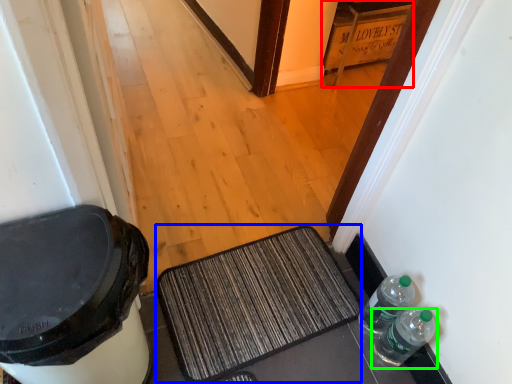
Question: Based on their relative distances, which object is farther from cabinetry (highlighted by a red box)? Choose from doormat (highlighted by a blue box) and bottle (highlighted by a green box).

Choices:
 (A) doormat
 (B) bottle

Answer: (B)